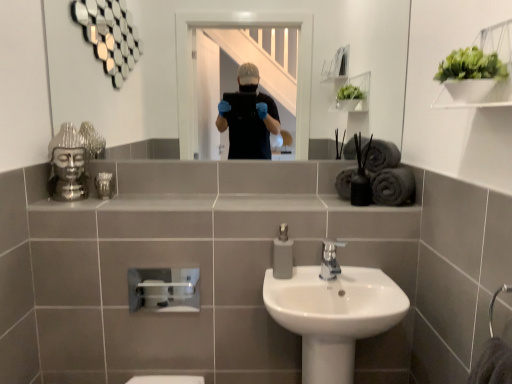
This screenshot has height=384, width=512. What do you see at coordinates (104, 184) in the screenshot? I see `metallic glass at upper left` at bounding box center [104, 184].

Measure the distance between white glossy sink at center and camera.

They are 1.20 meters apart.

The image size is (512, 384). What are the coordinates of `white glossy sink at center` in the screenshot? It's located at (333, 315).

What do you see at coordinates (330, 260) in the screenshot? The image size is (512, 384). I see `satin nickel faucet at center` at bounding box center [330, 260].

What is the approximate width of matte gray soap dispenser at center?

The width of matte gray soap dispenser at center is 4.52 inches.

Measure the distance between gray matte towel at upper right, which is the second bath towel in bottom-to-top order, and camera.

gray matte towel at upper right, which is the second bath towel in bottom-to-top order, and camera are 1.49 meters apart from each other.

Identify the location of dark gray matte bath towel at right, the second bath towel when ordered from top to bottom. Image resolution: width=512 pixels, height=384 pixels. (393, 186).

Where is `metallic glass at upper left`? The height and width of the screenshot is (384, 512). metallic glass at upper left is located at coordinates (104, 184).

Considering the sizes of objects matte gray soap dispenser at center and satin nickel faucet at center in the image provided, who is bigger, matte gray soap dispenser at center or satin nickel faucet at center?

Bigger between the two is matte gray soap dispenser at center.

Considering the relative positions of matte gray soap dispenser at center and satin nickel faucet at center in the image provided, is matte gray soap dispenser at center in front of satin nickel faucet at center?

No, matte gray soap dispenser at center is behind satin nickel faucet at center.

From the image's perspective, is matte gray soap dispenser at center below satin nickel faucet at center?

No.

From a real-world perspective, who is located higher, matte gray soap dispenser at center or white matte plant at upper right?

white matte plant at upper right is physically above.

Could you tell me if matte gray soap dispenser at center is turned towards white matte plant at upper right?

No, matte gray soap dispenser at center is not oriented towards white matte plant at upper right.

Consider the image. How many degrees apart are the facing directions of matte gray soap dispenser at center and white matte plant at upper right?

The angle between the facing direction of matte gray soap dispenser at center and the facing direction of white matte plant at upper right is 89.1 degrees.

Is the position of matte gray soap dispenser at center less distant than that of white matte plant at upper right?

No, it is behind white matte plant at upper right.

Which is correct: gray matte towel at upper right, which is the second bath towel in bottom-to-top order, is inside satin nickel faucet at center, or outside of it?

gray matte towel at upper right, which is the second bath towel in bottom-to-top order, is outside satin nickel faucet at center.

Is gray matte towel at upper right, the 1th bath towel positioned from the top, facing towards satin nickel faucet at center?

No, gray matte towel at upper right, the 1th bath towel positioned from the top, is not facing towards satin nickel faucet at center.

From the image's perspective, is gray matte towel at upper right, which is the second bath towel in bottom-to-top order, located above or below satin nickel faucet at center?

gray matte towel at upper right, which is the second bath towel in bottom-to-top order, is situated higher than satin nickel faucet at center in the image.

Measure the distance from gray matte towel at upper right, which is the second bath towel in bottom-to-top order, to satin nickel faucet at center.

A distance of 13.68 inches exists between gray matte towel at upper right, which is the second bath towel in bottom-to-top order, and satin nickel faucet at center.

From a real-world perspective, who is located higher, white glossy sink at center or gray matte towel at upper right, the 1th bath towel positioned from the top?

gray matte towel at upper right, the 1th bath towel positioned from the top, is physically above.

Is white glossy sink at center in front of or behind gray matte towel at upper right, the 1th bath towel positioned from the top, in the image?

Clearly, white glossy sink at center is in front of gray matte towel at upper right, the 1th bath towel positioned from the top.

Is gray matte towel at upper right, which is the second bath towel in bottom-to-top order, a part of white glossy sink at center?

No, gray matte towel at upper right, which is the second bath towel in bottom-to-top order, is not a part of white glossy sink at center.

Can you confirm if white glossy sink at center is wider than gray matte towel at upper right, the 1th bath towel positioned from the top?

Correct, the width of white glossy sink at center exceeds that of gray matte towel at upper right, the 1th bath towel positioned from the top.

Is metallic glass at upper left taller or shorter than white matte plant at upper right?

In the image, metallic glass at upper left appears to be shorter than white matte plant at upper right.

Considering the relative sizes of metallic glass at upper left and white matte plant at upper right in the image provided, is metallic glass at upper left smaller than white matte plant at upper right?

Yes.

Are metallic glass at upper left and white matte plant at upper right making contact?

metallic glass at upper left and white matte plant at upper right are clearly separated.

Is point (112, 176) positioned before point (509, 25)?

No, it is behind (509, 25).

Identify the location of shelf that is on the right side of satin nickel faucet at center. (479, 71).

Is satin nickel faucet at center spatially inside white matte plant at upper right, or outside of it?

satin nickel faucet at center cannot be found inside white matte plant at upper right.

Consider the image. From a real-world perspective, is satin nickel faucet at center physically located above or below white matte plant at upper right?

satin nickel faucet at center is situated lower than white matte plant at upper right in the real world.

Is satin nickel faucet at center facing towards white matte plant at upper right?

No, satin nickel faucet at center is not aimed at white matte plant at upper right.

From the image's perspective, relative to white glossy sink at center, is matte gray soap dispenser at center above or below?

matte gray soap dispenser at center is situated higher than white glossy sink at center in the image.

In the scene shown: Who is taller, matte gray soap dispenser at center or white glossy sink at center?

Standing taller between the two is white glossy sink at center.

From a real-world perspective, between matte gray soap dispenser at center and white glossy sink at center, who is vertically higher?

From a 3D spatial view, matte gray soap dispenser at center is above.

Is matte gray soap dispenser at center thinner than white glossy sink at center?

Indeed, matte gray soap dispenser at center has a lesser width compared to white glossy sink at center.

Locate an element on the screen. This screenshot has width=512, height=384. soap dispenser that appears above the satin nickel faucet at center (from a real-world perspective) is located at coordinates (282, 254).

The image size is (512, 384). Identify the location of soap dispenser located underneath the white matte plant at upper right (from a real-world perspective). (282, 254).

Looking at the image, which one is located closer to metallic glass at upper left, satin nickel faucet at center or matte gray soap dispenser at center?

Based on the image, matte gray soap dispenser at center appears to be nearer to metallic glass at upper left.

From the image, which object appears to be farther from satin nickel faucet at center, white matte plant at upper right or white glossy sink at center?

white matte plant at upper right lies further to satin nickel faucet at center than the other object.

Considering their positions, is gray matte towel at upper right, which is the second bath towel in bottom-to-top order, positioned further to white matte plant at upper right than satin nickel faucet at center?

satin nickel faucet at center.

From the image, which object appears to be farther from white glossy sink at center, dark gray matte bath towel at right, which is counted as the 1th bath towel, starting from the bottom, or white matte plant at upper right?

white matte plant at upper right is positioned further to the anchor white glossy sink at center.

Looking at this image, when comparing their distances from white matte plant at upper right, does gray matte towel at upper right, which is the second bath towel in bottom-to-top order, or white glossy sink at center seem further?

Among the two, white glossy sink at center is located further to white matte plant at upper right.

Considering their positions, is white matte plant at upper right positioned further to matte gray soap dispenser at center than metallic glass at upper left?

white matte plant at upper right is positioned further to the anchor matte gray soap dispenser at center.

Which object lies nearer to the anchor point matte gray soap dispenser at center, dark gray matte bath towel at right, the second bath towel when ordered from top to bottom, or white glossy sink at center?

Based on the image, white glossy sink at center appears to be nearer to matte gray soap dispenser at center.

Estimate the real-world distances between objects in this image. Which object is closer to gray matte towel at upper right, which is the second bath towel in bottom-to-top order, dark gray matte bath towel at right, the second bath towel when ordered from top to bottom, or metallic glass at upper left?

The object closer to gray matte towel at upper right, which is the second bath towel in bottom-to-top order, is dark gray matte bath towel at right, the second bath towel when ordered from top to bottom.

Identify the location of bath towel between metallic glass at upper left and dark gray matte bath towel at right, which is counted as the 1th bath towel, starting from the bottom, in the horizontal direction. The image size is (512, 384). (380, 155).

At what (x,y) coordinates should I click in order to perform the action: click on sink located between metallic glass at upper left and gray matte towel at upper right, the 1th bath towel positioned from the top, in the left-right direction. Please return your answer as a coordinate pair (x, y). The height and width of the screenshot is (384, 512). Looking at the image, I should click on (333, 315).

In order to click on sink located between metallic glass at upper left and satin nickel faucet at center in the left-right direction in this screenshot , I will do `click(333, 315)`.

Where is `tap situated between metallic glass at upper left and dark gray matte bath towel at right, which is counted as the 1th bath towel, starting from the bottom, from left to right`? This screenshot has width=512, height=384. tap situated between metallic glass at upper left and dark gray matte bath towel at right, which is counted as the 1th bath towel, starting from the bottom, from left to right is located at coordinates (330, 260).